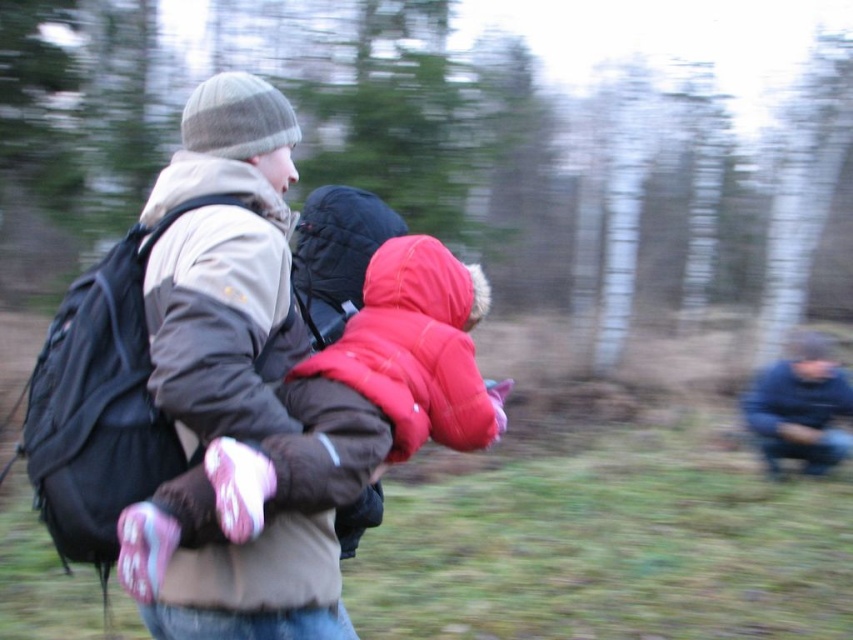
In the scene shown: You are a hiker trying to reach a cabin located 15 inches away from your current position. You have a black fabric backpack at left and a matte red jacket at center. Can you safely move forward without hitting either item?

The distance between the black fabric backpack at left and the matte red jacket at center is 13.00 inches. Since the cabin is 15 inches away, you can move forward safely as the items are within the 15 inches distance, but ensure you navigate around them to avoid collision.

You are navigating through a forest path and need to determine which of the two points, point (x=415, y=420) or point (x=109, y=362), is closer to you. Based on the image, which point is nearer?

Point (x=415, y=420) is closer to you because it is further to the viewer than point (x=109, y=362).